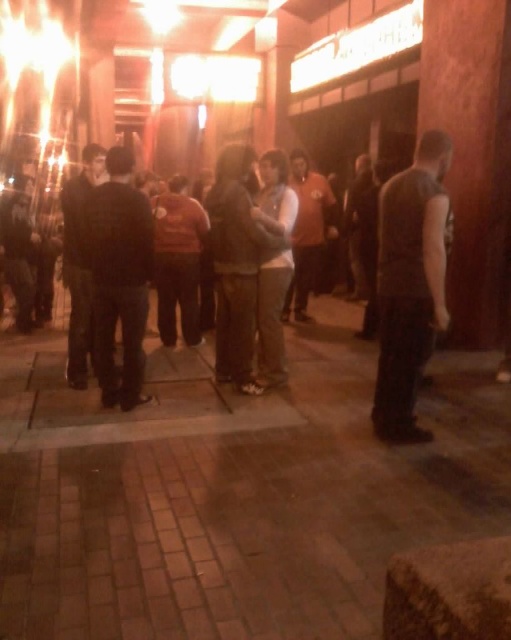
In the scene shown: You are a delivery person with a cart that is 1.8 meters wide. You need to pass between the dark gray vest at right and the dark gray sweater at center to reach the entrance. Can your cart fit through the space between them?

The distance between the dark gray vest at right and the dark gray sweater at center is 1.78 meters, which is slightly narrower than the cart width of 1.8 meters. Therefore, the cart cannot fit through the space between them.

You are trying to identify clothing items in the scene. Which clothing item, the dark gray vest at right or the dark gray sweater at center, is located lower in the image?

The dark gray vest at right is positioned under the dark gray sweater at center, so it is located lower in the image.